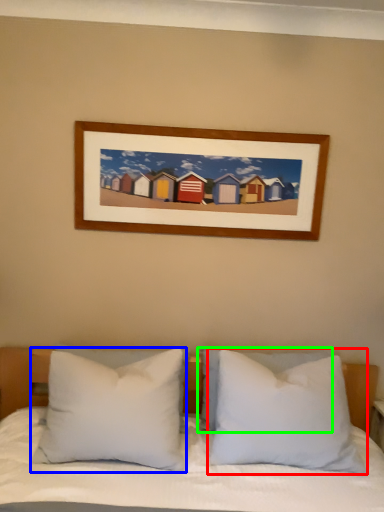
Question: Which is nearer to the pillow (highlighted by a red box)? pillow (highlighted by a blue box) or pillow (highlighted by a green box).

Choices:
 (A) pillow
 (B) pillow

Answer: (B)